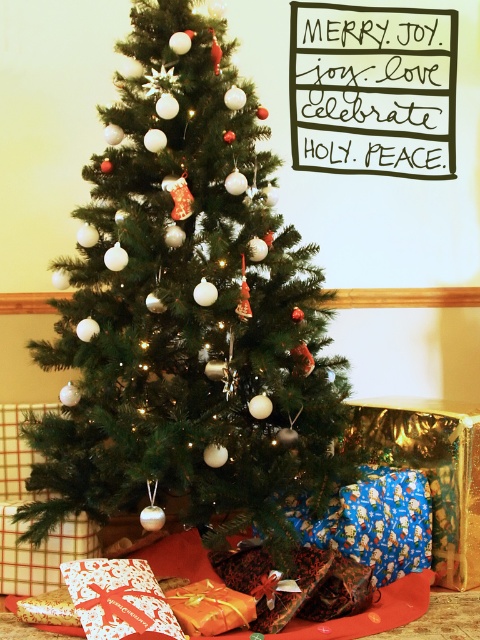
Question: Which object appears farthest from the camera in this image?

Choices:
 (A) shiny gold wrapping paper at lower center
 (B) white glossy gift at lower center

Answer: (A)

Question: Among these points, which one is nearest to the camera?

Choices:
 (A) (127, 582)
 (B) (211, 628)
 (C) (195, 428)

Answer: (B)

Question: Which of the following is the closest to the observer?

Choices:
 (A) (250, 480)
 (B) (176, 612)
 (C) (90, 609)

Answer: (C)

Question: Can you confirm if green matte christmas tree at center is bigger than shiny gold wrapping paper at lower center?

Choices:
 (A) no
 (B) yes

Answer: (B)

Question: From the image, what is the correct spatial relationship of green matte christmas tree at center in relation to white glossy gift at lower center?

Choices:
 (A) left
 (B) right

Answer: (B)

Question: Is green matte christmas tree at center above shiny gold wrapping paper at lower center?

Choices:
 (A) yes
 (B) no

Answer: (A)